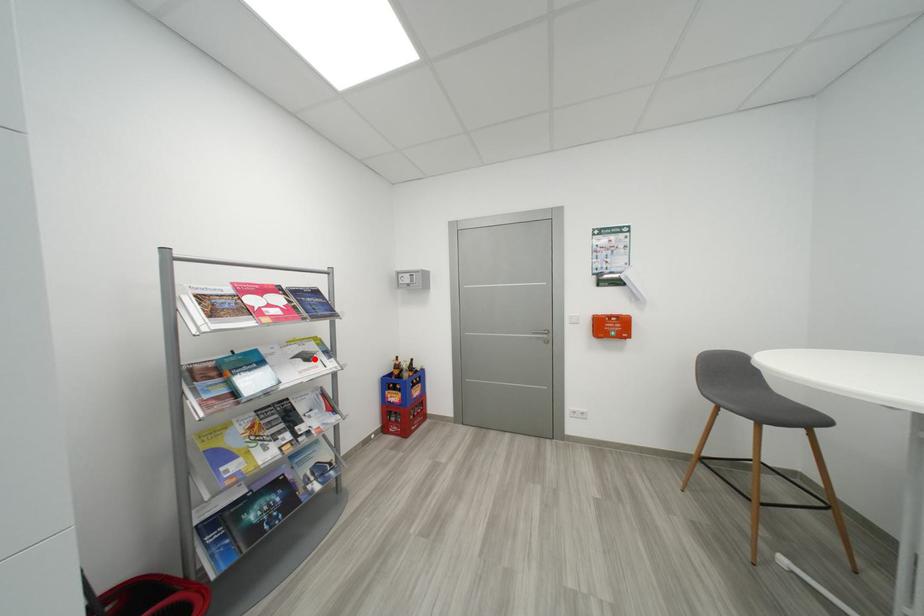
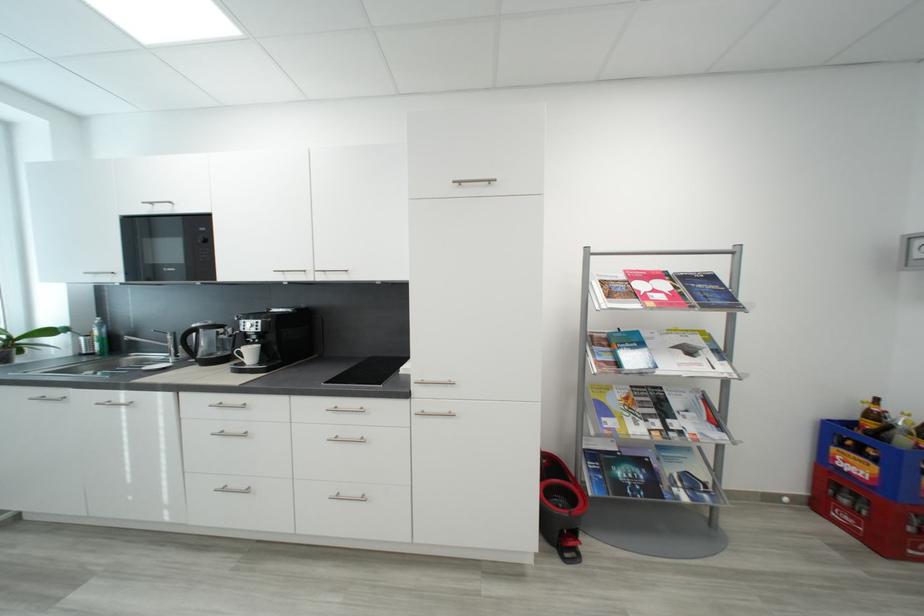
Find the pixel in the second image that matches the highlighted location in the first image.

(697, 353)